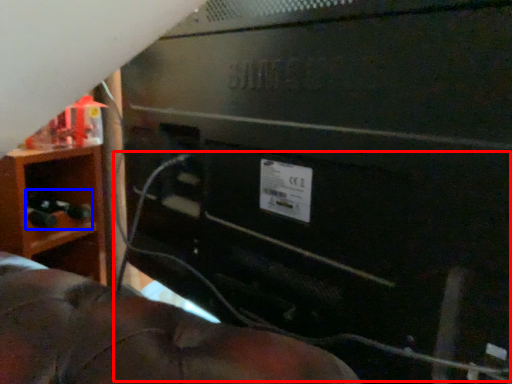
Question: Which object is further to the camera taking this photo, wire (highlighted by a red box) or toy (highlighted by a blue box)?

Choices:
 (A) wire
 (B) toy

Answer: (B)